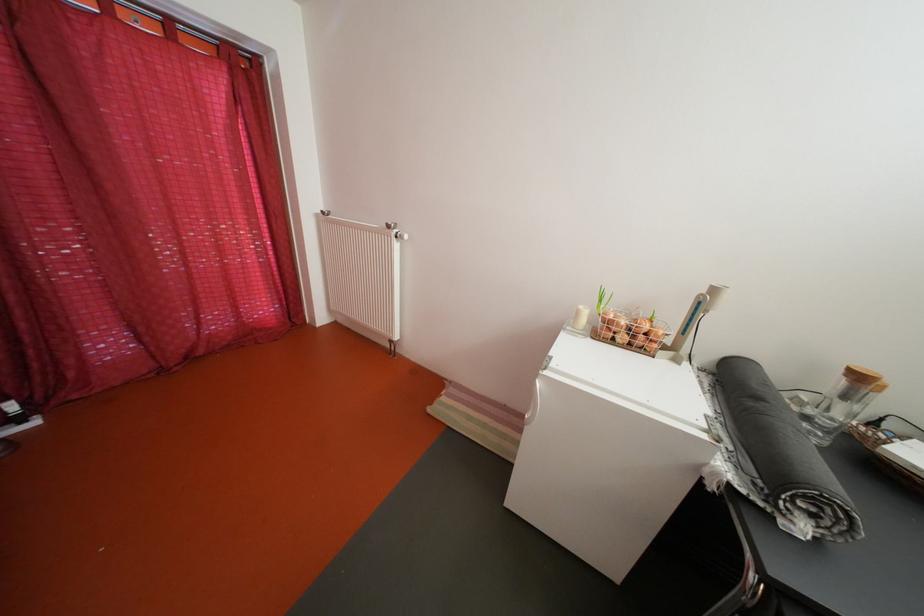
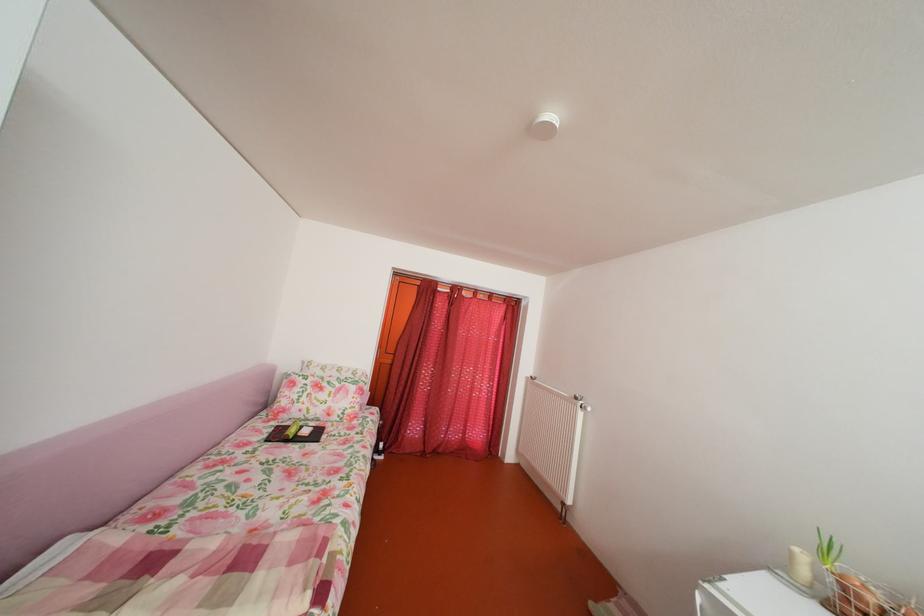
The point at (589, 318) is marked in the first image. Where is the corresponding point in the second image?

(803, 561)